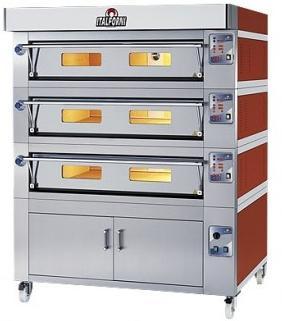
Identify the location of corners. The image size is (282, 321). (230, 20), (266, 14), (266, 260), (234, 294), (14, 278), (4, 7).